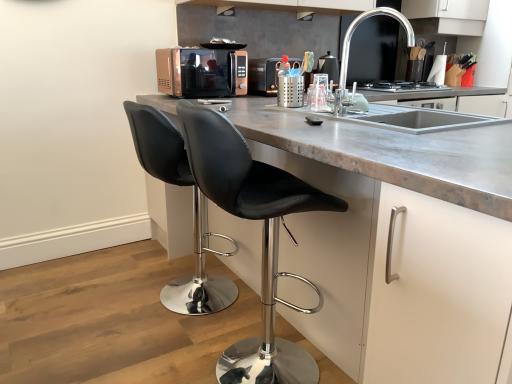
Question: Does black leather stool at center, which ranks as the 2th chair in back-to-front order, have a smaller size compared to black leather stool at lower left, positioned as the 1th chair in back-to-front order?

Choices:
 (A) no
 (B) yes

Answer: (A)

Question: Can you confirm if black leather stool at center, the first chair viewed from the front, is bigger than black leather stool at lower left, positioned as the 1th chair in back-to-front order?

Choices:
 (A) yes
 (B) no

Answer: (A)

Question: From a real-world perspective, is black leather stool at center, which ranks as the 2th chair in back-to-front order, positioned under black leather stool at lower left, positioned as the 1th chair in back-to-front order, based on gravity?

Choices:
 (A) no
 (B) yes

Answer: (A)

Question: Considering the relative sizes of black leather stool at center, which ranks as the 2th chair in back-to-front order, and black leather stool at lower left, the second chair viewed from the front, in the image provided, is black leather stool at center, which ranks as the 2th chair in back-to-front order, wider than black leather stool at lower left, the second chair viewed from the front,?

Choices:
 (A) yes
 (B) no

Answer: (A)

Question: Is black leather stool at center, the first chair viewed from the front, oriented towards black leather stool at lower left, positioned as the 1th chair in back-to-front order?

Choices:
 (A) no
 (B) yes

Answer: (A)

Question: From the image's perspective, relative to black leather stool at center, which ranks as the 2th chair in back-to-front order, is polished chrome faucet at upper right above or below?

Choices:
 (A) above
 (B) below

Answer: (A)

Question: Does point (401, 24) appear closer or farther from the camera than point (248, 178)?

Choices:
 (A) farther
 (B) closer

Answer: (A)

Question: Choose the correct answer: Is polished chrome faucet at upper right inside black leather stool at center, the first chair viewed from the front, or outside it?

Choices:
 (A) outside
 (B) inside

Answer: (A)

Question: Relative to black leather stool at center, the first chair viewed from the front, is polished chrome faucet at upper right in front or behind?

Choices:
 (A) front
 (B) behind

Answer: (B)

Question: Considering the positions of metallic microwave at center and black glass stove at center in the image, is metallic microwave at center bigger or smaller than black glass stove at center?

Choices:
 (A) big
 (B) small

Answer: (A)

Question: From a real-world perspective, is metallic microwave at center physically located above or below black glass stove at center?

Choices:
 (A) below
 (B) above

Answer: (B)

Question: Is point (272, 66) closer or farther from the camera than point (402, 84)?

Choices:
 (A) closer
 (B) farther

Answer: (A)

Question: Is metallic microwave at center in front of or behind black glass stove at center in the image?

Choices:
 (A) front
 (B) behind

Answer: (A)

Question: Is black leather stool at center, which ranks as the 2th chair in back-to-front order, in front of or behind polished chrome faucet at upper right in the image?

Choices:
 (A) behind
 (B) front

Answer: (B)

Question: From a real-world perspective, is black leather stool at center, the first chair viewed from the front, physically located above or below polished chrome faucet at upper right?

Choices:
 (A) below
 (B) above

Answer: (A)